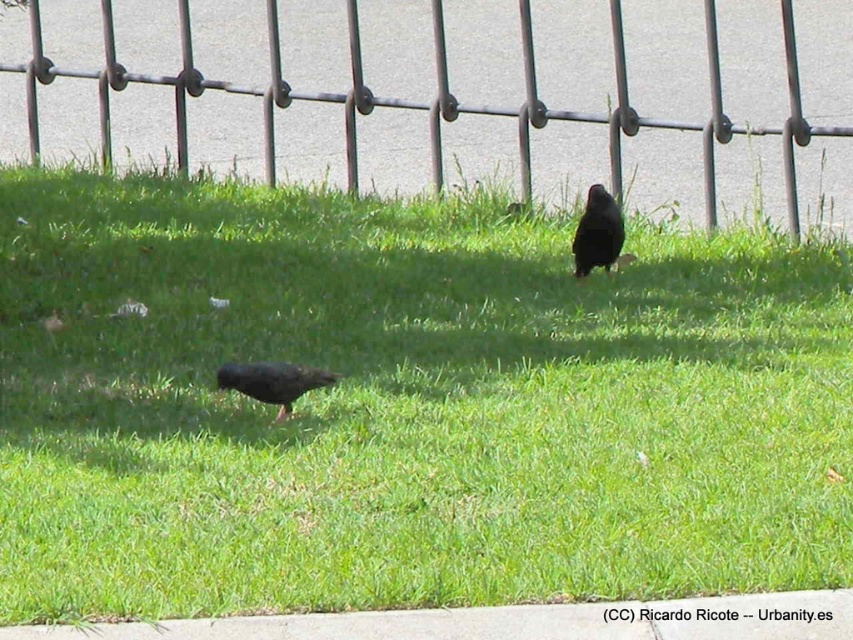
Question: Can you confirm if metallic wire fence at upper center is positioned to the left of shiny black bird at center?

Choices:
 (A) yes
 (B) no

Answer: (B)

Question: Which is nearer to the shiny black bird at center?

Choices:
 (A) shiny black bird at upper center
 (B) metallic wire fence at upper center

Answer: (A)

Question: Which object is positioned closest to the shiny black bird at center?

Choices:
 (A) metallic wire fence at upper center
 (B) shiny black bird at upper center

Answer: (B)

Question: Does shiny black bird at center come in front of shiny black bird at upper center?

Choices:
 (A) no
 (B) yes

Answer: (B)

Question: Which point is closer to the camera taking this photo?

Choices:
 (A) (276, 381)
 (B) (440, 74)

Answer: (A)

Question: Is metallic wire fence at upper center thinner than shiny black bird at center?

Choices:
 (A) yes
 (B) no

Answer: (A)